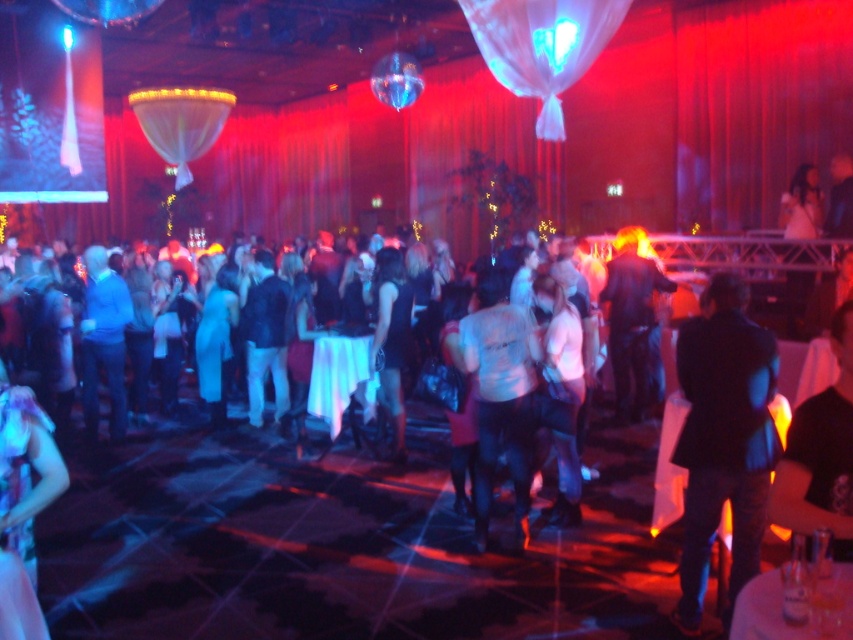
Question: Which point is farther from the camera taking this photo?

Choices:
 (A) pyautogui.click(x=697, y=470)
 (B) pyautogui.click(x=488, y=424)

Answer: (B)

Question: Which object is positioned closest to the black matte shirt at center?

Choices:
 (A) white matte shirt at center
 (B) shiny purple dress at lower left

Answer: (A)

Question: Is the position of white matte shirt at center more distant than that of shiny purple dress at lower left?

Choices:
 (A) yes
 (B) no

Answer: (A)

Question: From the image, what is the correct spatial relationship of white matte shirt at center in relation to shiny purple dress at lower left?

Choices:
 (A) right
 (B) left

Answer: (A)

Question: Which point is farther to the camera?

Choices:
 (A) (848, 378)
 (B) (13, 608)

Answer: (A)

Question: Can you confirm if shiny purple dress at lower left is smaller than black satin dress at center?

Choices:
 (A) no
 (B) yes

Answer: (B)